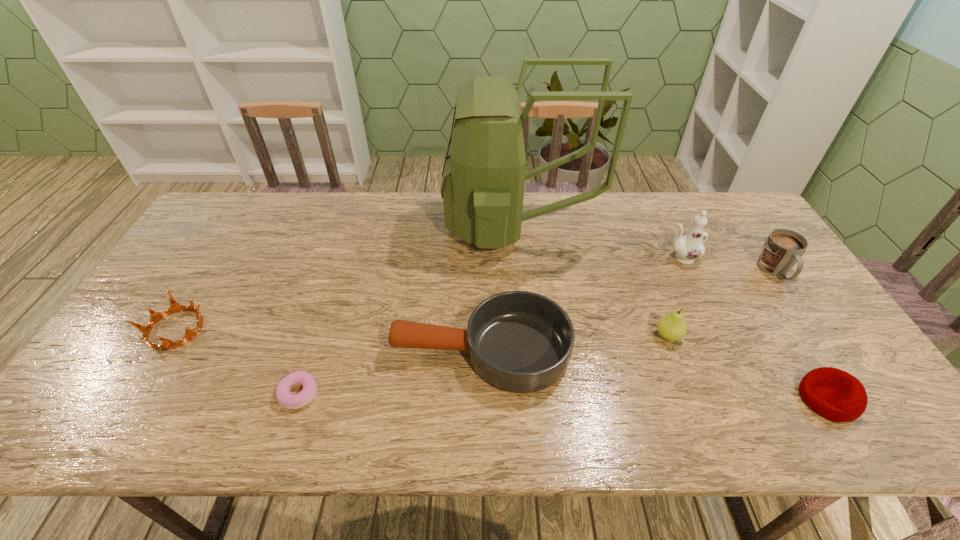
I want to click on free space located on the front pocket of the backpack, so pyautogui.click(x=335, y=225).

The height and width of the screenshot is (540, 960). What are the coordinates of `free location located 0.320m on the front pocket of the backpack` in the screenshot? It's located at tap(349, 225).

This screenshot has width=960, height=540. Find the location of `free space located 0.400m on the front pocket of the backpack`. free space located 0.400m on the front pocket of the backpack is located at coordinates (325, 225).

You are a GUI agent. You are given a task and a screenshot of the screen. Output one action in this format:
    pyautogui.click(x=<x>, y=<y>)
    Task: Click on the free location located 0.240m at the spout of the chinaware
    
    Given the screenshot: What is the action you would take?
    pyautogui.click(x=585, y=258)

This screenshot has width=960, height=540. In order to click on vacant space located 0.360m at the spout of the chinaware in this screenshot , I will do `click(546, 258)`.

Locate an element on the screen. This screenshot has width=960, height=540. blank area located 0.270m at the spout of the chinaware is located at coordinates (575, 258).

Locate an element on the screen. This screenshot has height=540, width=960. vacant space located 0.070m on the side of the mug with the handle is located at coordinates pyautogui.click(x=800, y=307).

Locate an element on the screen. Image resolution: width=960 pixels, height=540 pixels. free region located 0.200m on the left of the pear is located at coordinates (x=578, y=335).

At what (x,y) coordinates should I click in order to perform the action: click on vacant space located on the handle side of the pan. Please return your answer as a coordinate pair (x, y). The height and width of the screenshot is (540, 960). Looking at the image, I should click on (270, 350).

Find the location of a particular element. The width and height of the screenshot is (960, 540). free spot located on the handle side of the pan is located at coordinates point(341,350).